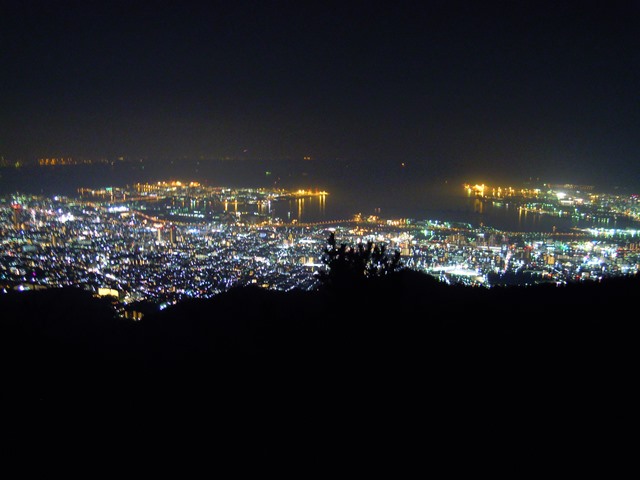
The image size is (640, 480). Identify the location of light. (324, 191).